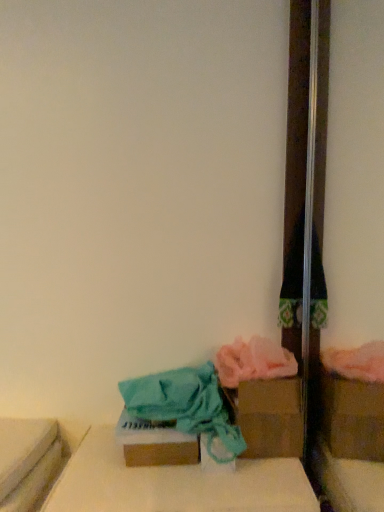
Where is `vacant area that is in front of brown cardboard box at lower center, acting as the 2th storage box starting from the right`? The width and height of the screenshot is (384, 512). vacant area that is in front of brown cardboard box at lower center, acting as the 2th storage box starting from the right is located at coordinates (153, 492).